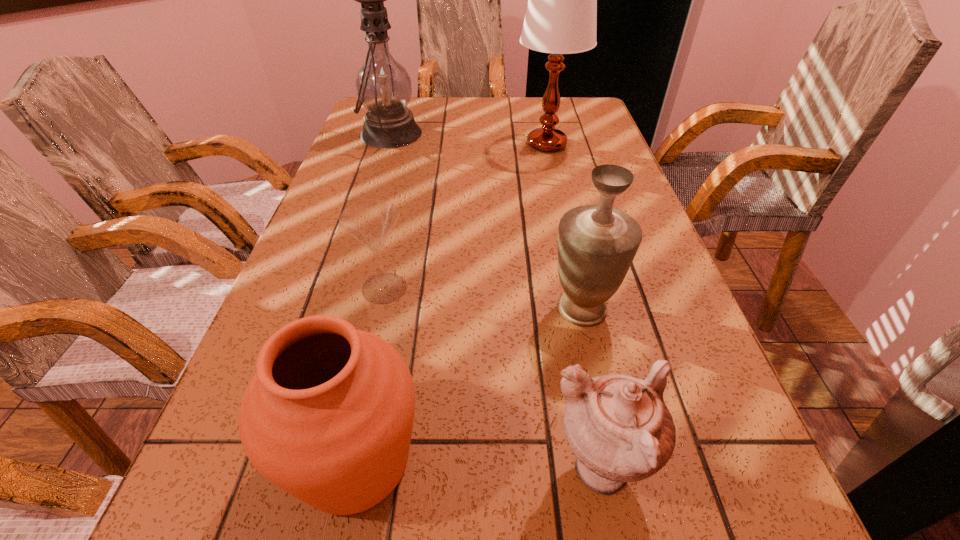
What are the coordinates of `vacant space located 0.210m on the back of the shortest urn` in the screenshot? It's located at (569, 320).

Find the location of a particular element. free space located on the front of the shortest object is located at coordinates (339, 496).

Where is `object located at the far edge`? The height and width of the screenshot is (540, 960). object located at the far edge is located at coordinates point(383,85).

I want to click on oil lamp that is positioned at the left edge, so click(x=383, y=85).

Locate an element on the screen. urn located in the left edge section of the desktop is located at coordinates (328, 416).

The height and width of the screenshot is (540, 960). I want to click on flute glass that is at the left edge, so click(x=370, y=222).

Identify the location of table lamp that is at the right edge. (561, 17).

This screenshot has height=540, width=960. In order to click on object located at the far left corner in this screenshot , I will do `click(383, 85)`.

Identify the location of free point at the far edge. This screenshot has width=960, height=540. (414, 104).

In the image, there is a desktop. Find the location of `free space at the left edge`. free space at the left edge is located at coordinates pos(377,150).